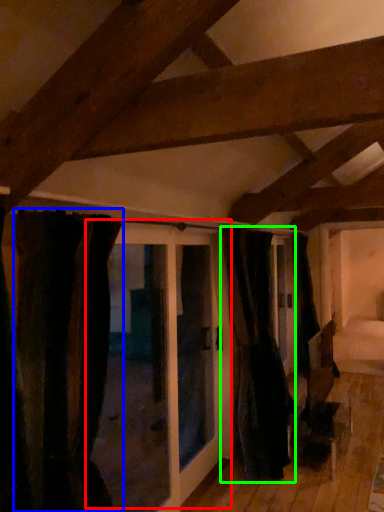
Question: Which object is positioned farthest from door (highlighted by a red box)? Select from curtain (highlighted by a blue box) and curtain (highlighted by a green box).

Choices:
 (A) curtain
 (B) curtain

Answer: (A)